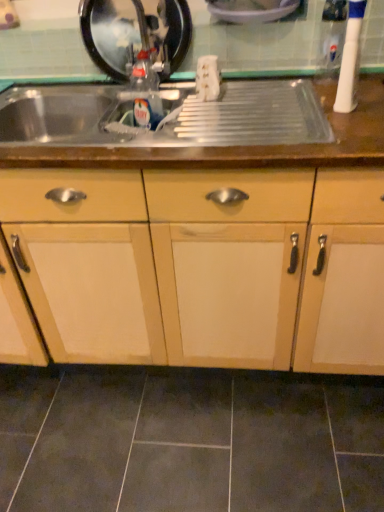
Question: Is dark gray ceramic tile at lower center inside the boundaries of wooden cabinet at center, or outside?

Choices:
 (A) outside
 (B) inside

Answer: (A)

Question: Is dark gray ceramic tile at lower center taller or shorter than wooden cabinet at center?

Choices:
 (A) tall
 (B) short

Answer: (B)

Question: Based on their relative distances, which object is nearer to the white plastic bowl at upper center, the 2th appliance viewed from the left?

Choices:
 (A) metallic black sink at upper left, marked as the 3th appliance in a right-to-left arrangement
 (B) metallic stainless steel sink at upper center
 (C) dark gray ceramic tile at lower center
 (D) wooden cabinet at center
 (E) white plastic toothbrush at upper right, which is counted as the third appliance, starting from the left

Answer: (A)

Question: Estimate the real-world distances between objects in this image. Which object is farther from the white plastic bowl at upper center, which is the 2th appliance in right-to-left order?

Choices:
 (A) wooden cabinet at center
 (B) dark gray ceramic tile at lower center
 (C) metallic stainless steel sink at upper center
 (D) metallic black sink at upper left, marked as the 3th appliance in a right-to-left arrangement
 (E) white plastic toothbrush at upper right, the 1th appliance viewed from the right

Answer: (B)